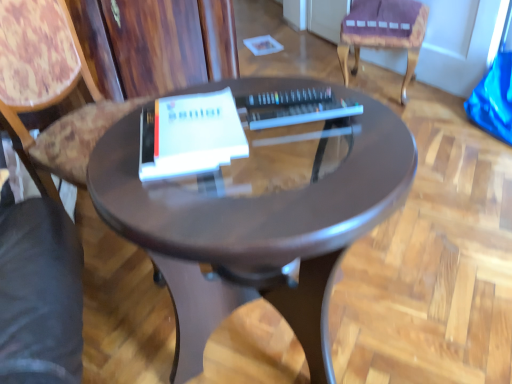
Question: Considering the relative sizes of wooden at left, which is the first chair from left to right, and glossy brown table at center in the image provided, is wooden at left, which is the first chair from left to right, thinner than glossy brown table at center?

Choices:
 (A) no
 (B) yes

Answer: (B)

Question: Is wooden at left, which ranks as the 2th chair in right-to-left order, in front of glossy brown table at center?

Choices:
 (A) no
 (B) yes

Answer: (A)

Question: Would you say wooden at left, which is the first chair from left to right, is outside glossy brown table at center?

Choices:
 (A) yes
 (B) no

Answer: (A)

Question: Does wooden at left, the 2th chair when ordered from back to front, contain glossy brown table at center?

Choices:
 (A) yes
 (B) no

Answer: (B)

Question: From the image's perspective, is wooden at left, which is the first chair from left to right, below glossy brown table at center?

Choices:
 (A) no
 (B) yes

Answer: (A)

Question: From a real-world perspective, is wooden at left, arranged as the 1th chair when viewed from the front, over glossy brown table at center?

Choices:
 (A) no
 (B) yes

Answer: (B)

Question: Can you confirm if white matte paperback book at center is wider than purple fabric cushion at upper right, arranged as the 1th chair when viewed from the back?

Choices:
 (A) no
 (B) yes

Answer: (A)

Question: From the image's perspective, is white matte paperback book at center under purple fabric cushion at upper right, the 1th chair from the right?

Choices:
 (A) yes
 (B) no

Answer: (A)

Question: Is white matte paperback book at center aimed at purple fabric cushion at upper right, the 2th chair when ordered from left to right?

Choices:
 (A) yes
 (B) no

Answer: (B)

Question: From a real-world perspective, is white matte paperback book at center positioned over purple fabric cushion at upper right, the 2th chair when ordered from left to right, based on gravity?

Choices:
 (A) no
 (B) yes

Answer: (B)

Question: From a real-world perspective, is white matte paperback book at center below purple fabric cushion at upper right, arranged as the 1th chair when viewed from the back?

Choices:
 (A) no
 (B) yes

Answer: (A)

Question: From the image's perspective, would you say white matte paperback book at center is positioned over purple fabric cushion at upper right, the 2th chair viewed from the front?

Choices:
 (A) no
 (B) yes

Answer: (A)

Question: Does white matte paperback book at center have a lesser width compared to glossy brown table at center?

Choices:
 (A) no
 (B) yes

Answer: (B)